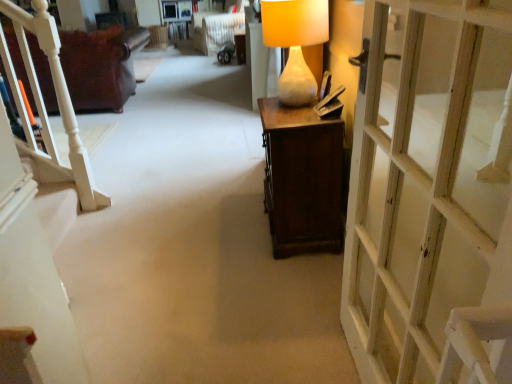
Question: Does matte white vase at center have a greater width compared to leather couch at left?

Choices:
 (A) no
 (B) yes

Answer: (A)

Question: Is matte white vase at center further to the viewer compared to leather couch at left?

Choices:
 (A) no
 (B) yes

Answer: (A)

Question: From the image's perspective, is matte white vase at center under leather couch at left?

Choices:
 (A) no
 (B) yes

Answer: (B)

Question: Considering the relative positions of matte white vase at center and leather couch at left in the image provided, is matte white vase at center to the left of leather couch at left from the viewer's perspective?

Choices:
 (A) yes
 (B) no

Answer: (B)

Question: Would you say leather couch at left is part of matte white vase at center's contents?

Choices:
 (A) no
 (B) yes

Answer: (A)

Question: Is leather couch at left at the back of matte white vase at center?

Choices:
 (A) yes
 (B) no

Answer: (B)

Question: Does matte white vase at center come in front of white wooden door at right?

Choices:
 (A) no
 (B) yes

Answer: (A)

Question: Is matte white vase at center shorter than white wooden door at right?

Choices:
 (A) no
 (B) yes

Answer: (B)

Question: Considering the relative positions of matte white vase at center and white wooden door at right in the image provided, is matte white vase at center to the left of white wooden door at right from the viewer's perspective?

Choices:
 (A) no
 (B) yes

Answer: (B)

Question: Considering the relative sizes of matte white vase at center and white wooden door at right in the image provided, is matte white vase at center wider than white wooden door at right?

Choices:
 (A) yes
 (B) no

Answer: (A)

Question: From the image's perspective, is matte white vase at center above white wooden door at right?

Choices:
 (A) no
 (B) yes

Answer: (B)

Question: Is matte white vase at center turned away from white wooden door at right?

Choices:
 (A) no
 (B) yes

Answer: (A)

Question: From a real-world perspective, is white wooden door at right on top of leather couch at left?

Choices:
 (A) no
 (B) yes

Answer: (B)